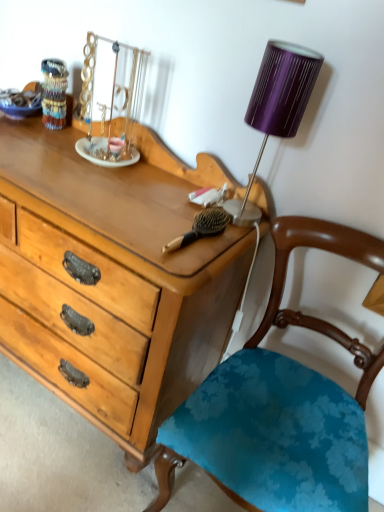
Question: From the image's perspective, is purple ribbed fabric lampshade at upper right under blue floral fabric chair at center?

Choices:
 (A) yes
 (B) no

Answer: (B)

Question: Does purple ribbed fabric lampshade at upper right have a greater height compared to blue floral fabric chair at center?

Choices:
 (A) yes
 (B) no

Answer: (B)

Question: Considering the relative sizes of purple ribbed fabric lampshade at upper right and blue floral fabric chair at center in the image provided, is purple ribbed fabric lampshade at upper right bigger than blue floral fabric chair at center?

Choices:
 (A) no
 (B) yes

Answer: (A)

Question: Is purple ribbed fabric lampshade at upper right oriented towards blue floral fabric chair at center?

Choices:
 (A) yes
 (B) no

Answer: (B)

Question: Would you say purple ribbed fabric lampshade at upper right is a long distance from blue floral fabric chair at center?

Choices:
 (A) no
 (B) yes

Answer: (A)

Question: From the image's perspective, is brown wooden brush at center positioned above or below purple ribbed fabric lampshade at upper right?

Choices:
 (A) below
 (B) above

Answer: (A)

Question: Considering their positions, is brown wooden brush at center located in front of or behind purple ribbed fabric lampshade at upper right?

Choices:
 (A) behind
 (B) front

Answer: (A)

Question: From their relative heights in the image, would you say brown wooden brush at center is taller or shorter than purple ribbed fabric lampshade at upper right?

Choices:
 (A) tall
 (B) short

Answer: (B)

Question: Is brown wooden brush at center spatially inside purple ribbed fabric lampshade at upper right, or outside of it?

Choices:
 (A) outside
 (B) inside

Answer: (A)

Question: Choose the correct answer: Is purple ribbed fabric lampshade at upper right inside blue floral fabric chair at center or outside it?

Choices:
 (A) outside
 (B) inside

Answer: (A)

Question: Relative to blue floral fabric chair at center, is purple ribbed fabric lampshade at upper right in front or behind?

Choices:
 (A) behind
 (B) front

Answer: (A)

Question: In the image, is purple ribbed fabric lampshade at upper right on the left side or the right side of blue floral fabric chair at center?

Choices:
 (A) left
 (B) right

Answer: (A)

Question: Considering the positions of point (266, 54) and point (261, 452), is point (266, 54) closer or farther from the camera than point (261, 452)?

Choices:
 (A) closer
 (B) farther

Answer: (A)

Question: Considering the positions of point (307, 75) and point (203, 227), is point (307, 75) closer or farther from the camera than point (203, 227)?

Choices:
 (A) closer
 (B) farther

Answer: (A)

Question: In the image, is purple ribbed fabric lampshade at upper right positioned in front of or behind brown wooden brush at center?

Choices:
 (A) front
 (B) behind

Answer: (A)